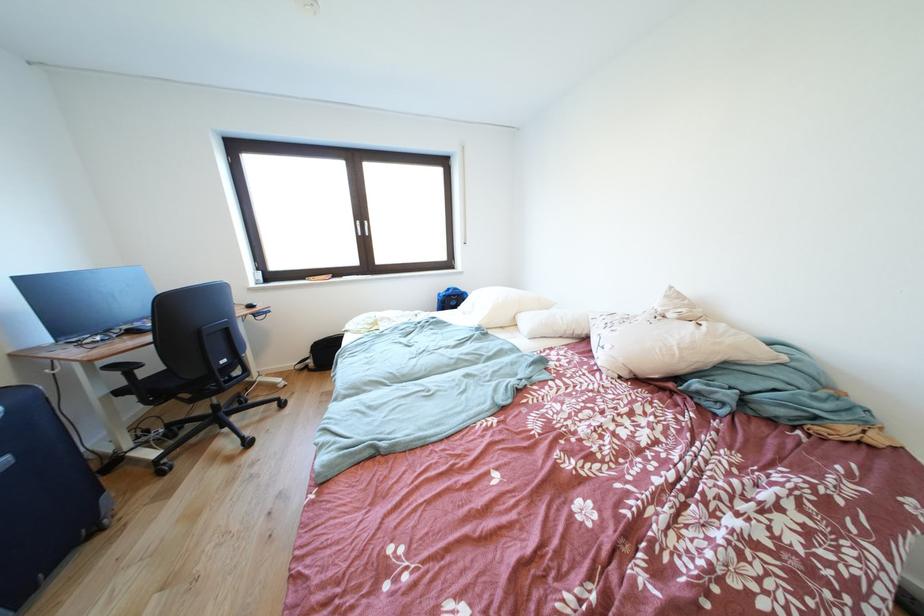
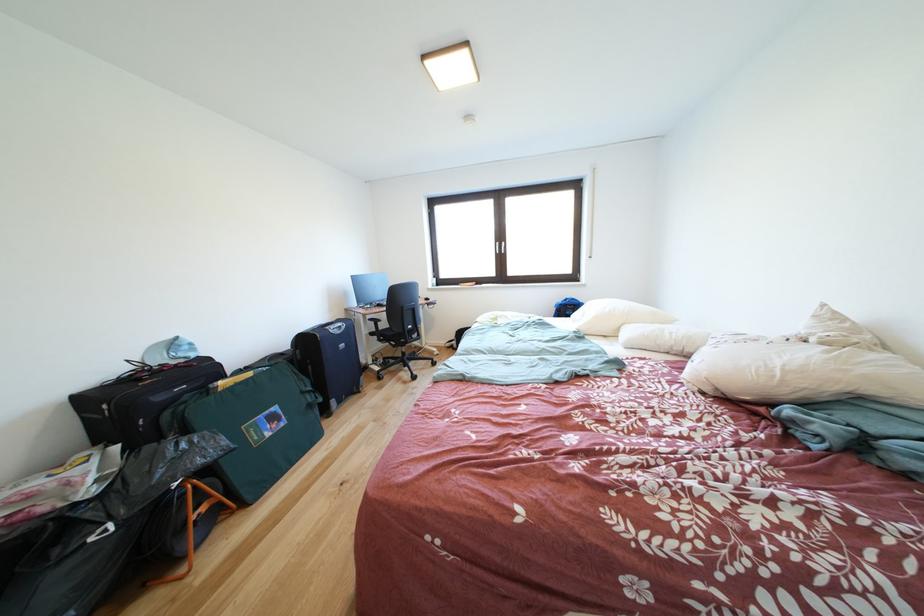
Find the pixel in the second image that matches the point at 128,397 in the first image.

(380, 339)